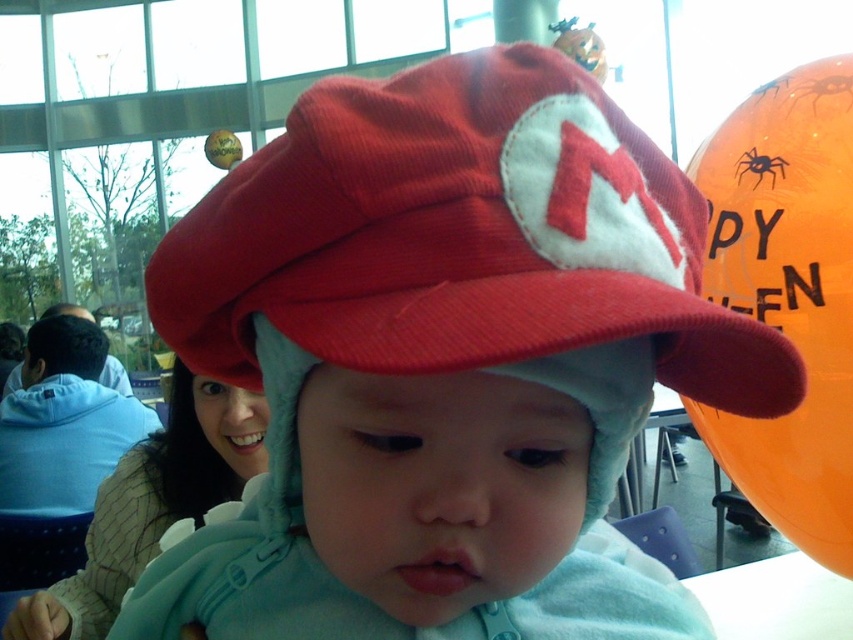
Question: Which object is closer to the camera taking this photo?

Choices:
 (A) black matte spider at upper right
 (B) orange glossy balloon at upper right
 (C) red corduroy hat at center

Answer: (C)

Question: Is red corduroy hat at center further to the viewer compared to orange glossy balloon at upper right?

Choices:
 (A) yes
 (B) no

Answer: (B)

Question: Considering the real-world distances, which object is closest to the orange glossy balloon at upper right?

Choices:
 (A) black matte spider at upper right
 (B) red corduroy hat at center

Answer: (A)

Question: Which point is closer to the camera?

Choices:
 (A) red corduroy hat at center
 (B) black matte spider at upper right

Answer: (A)

Question: Does red corduroy hat at center appear under black matte spider at upper right?

Choices:
 (A) yes
 (B) no

Answer: (A)

Question: Does orange glossy balloon at upper right appear on the right side of black matte spider at upper right?

Choices:
 (A) no
 (B) yes

Answer: (A)